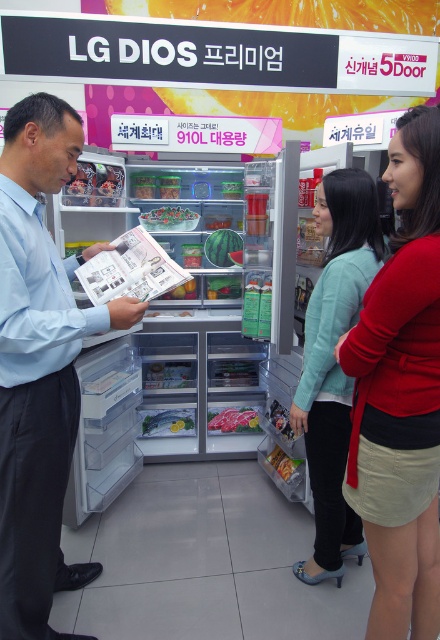
You are a customer in the store and you see the light blue sweater at center and the shiny plastic snack at center. Which item is closer to you?

The light blue sweater at center is closer to you because it is positioned over the shiny plastic snack at center, indicating it is in front.

Please describe the exact location of the red satin blouse at center in the image using coordinates. The coordinates should be in the format of a point with two decimal places separated by a comma. The scene is a retail store with an LG DIOS refrigerator displayed in the center with open doors showing food items. There are also signboards above the refrigerator.

The red satin blouse at center is located at point coordinates of (400, 396).